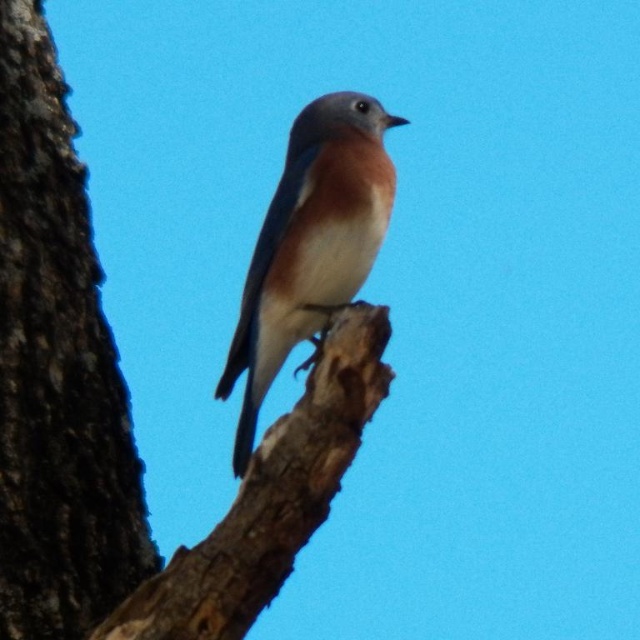
Question: Can you confirm if brown rough bark at center is positioned below blue glossy bird at center?

Choices:
 (A) no
 (B) yes

Answer: (B)

Question: Does brown rough bark at center have a smaller size compared to blue glossy bird at center?

Choices:
 (A) no
 (B) yes

Answer: (A)

Question: Which point appears farthest from the camera in this image?

Choices:
 (A) (246, 490)
 (B) (74, 582)

Answer: (B)

Question: Which of the following is the closest to the observer?

Choices:
 (A) brown rough tree branch at center
 (B) dark brown rough bark at left
 (C) brown rough bark at center

Answer: (A)

Question: Which of the following is the farthest from the observer?

Choices:
 (A) (237, 632)
 (B) (358, 99)
 (C) (104, 556)
 (D) (96, 536)

Answer: (B)

Question: Is brown rough bark at center wider than dark brown rough bark at left?

Choices:
 (A) yes
 (B) no

Answer: (B)